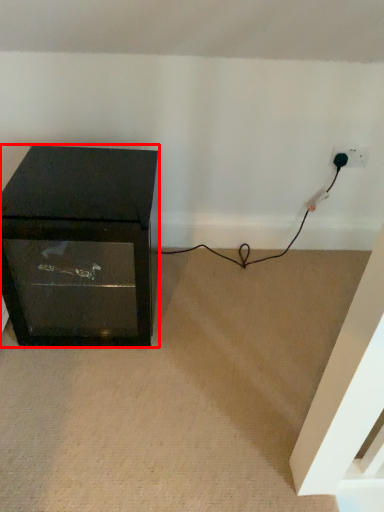
Question: From the image's perspective, what is the correct spatial relationship of furniture (annotated by the red box) in relation to plug?

Choices:
 (A) above
 (B) below

Answer: (B)